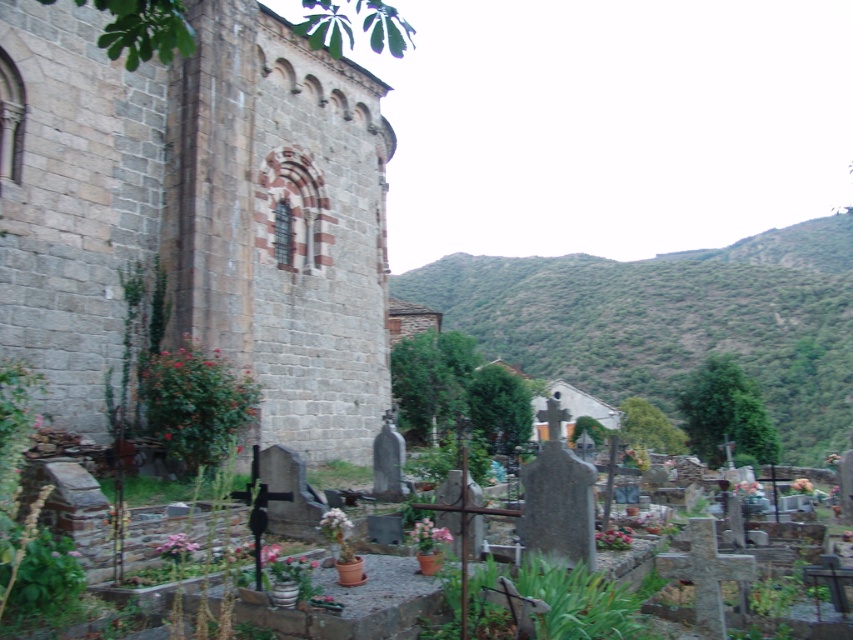
You are standing at the historic stone building and want to walk to the point marked as point (799, 301). There is an obstacle at point (364, 177). Will you encounter this obstacle before reaching your destination?

Yes, you will encounter the obstacle at point (364, 177) before reaching point (799, 301) because point (364, 177) is in front of point (799, 301).

You are standing at the entrance of the cemetery and want to visit the gray stone church at center. According to the map, the church is at coordinates point 0.338, 0.232. If you move straight ahead from your current position, will you reach the church directly?

The gray stone church at center is located at point (196, 216), so moving straight ahead from the entrance will lead you directly to the church as it is positioned centrally in the scene.

You are standing in the cemetery and want to take a photo of the gray stone church at center and the green leafy hillside at upper right. Which object is positioned higher in the image?

The green leafy hillside at upper right is positioned higher in the image as it is located above the gray stone church at center.